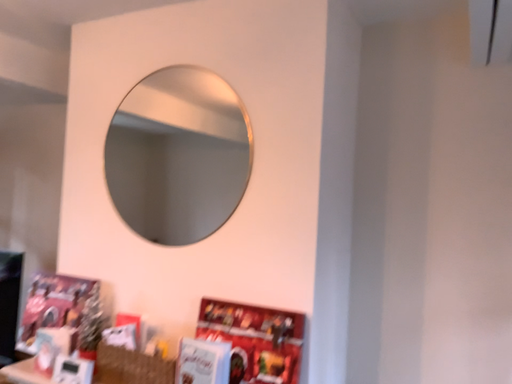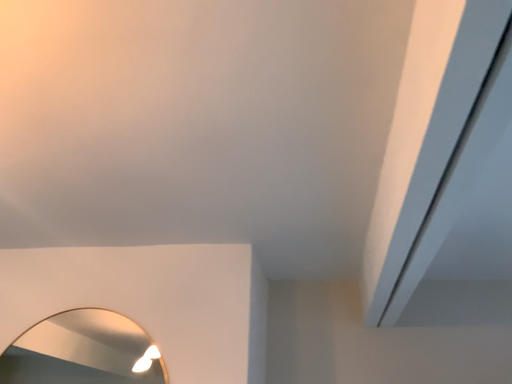
Question: How did the camera likely rotate when shooting the video?

Choices:
 (A) rotated left
 (B) rotated right

Answer: (B)